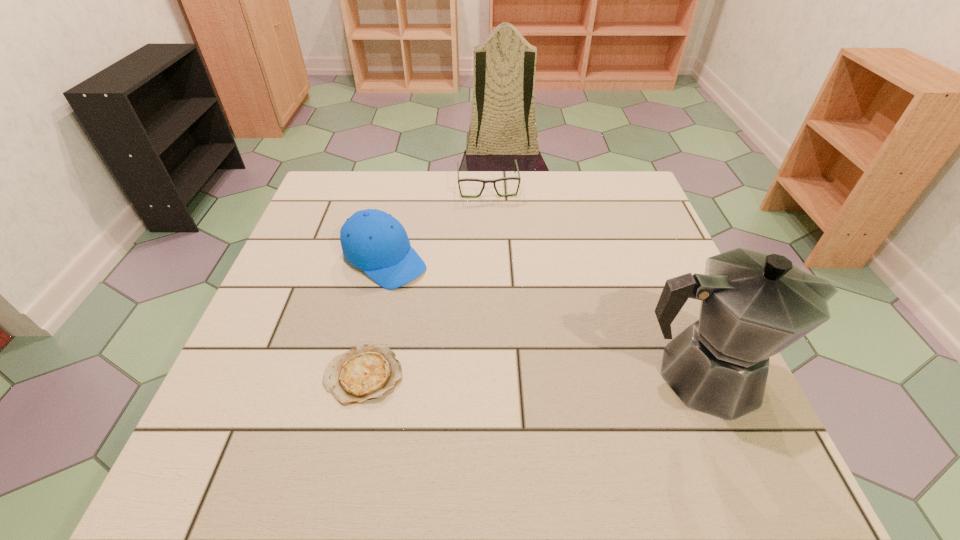
This screenshot has height=540, width=960. I want to click on vacant space located 0.090m on the front-facing side of the third nearest object, so click(436, 302).

Where is `vacant space situated on the lens of the third object from left to right`? vacant space situated on the lens of the third object from left to right is located at coordinates (500, 281).

I want to click on vacant space located on the lens of the third object from left to right, so click(x=499, y=272).

In order to click on blank area located on the lens of the third object from left to right in this screenshot , I will do `click(492, 211)`.

At what (x,y) coordinates should I click in order to perform the action: click on object that is at the far edge. Please return your answer as a coordinate pair (x, y). The image size is (960, 540). Looking at the image, I should click on (494, 181).

Find the location of `quiche that is positioned at the near edge`. quiche that is positioned at the near edge is located at coordinates pyautogui.click(x=365, y=372).

The height and width of the screenshot is (540, 960). Find the location of `coffeepot positioned at the near edge`. coffeepot positioned at the near edge is located at coordinates (754, 305).

Identify the location of object present at the left edge. (372, 240).

You are a GUI agent. You are given a task and a screenshot of the screen. Output one action in this format:
    pyautogui.click(x=<x>, y=<y>)
    Task: Click on the object that is positioned at the right edge
    The height and width of the screenshot is (540, 960).
    Given the screenshot: What is the action you would take?
    pyautogui.click(x=754, y=305)

Locate an element on the screen. The height and width of the screenshot is (540, 960). object present at the near right corner is located at coordinates (754, 305).